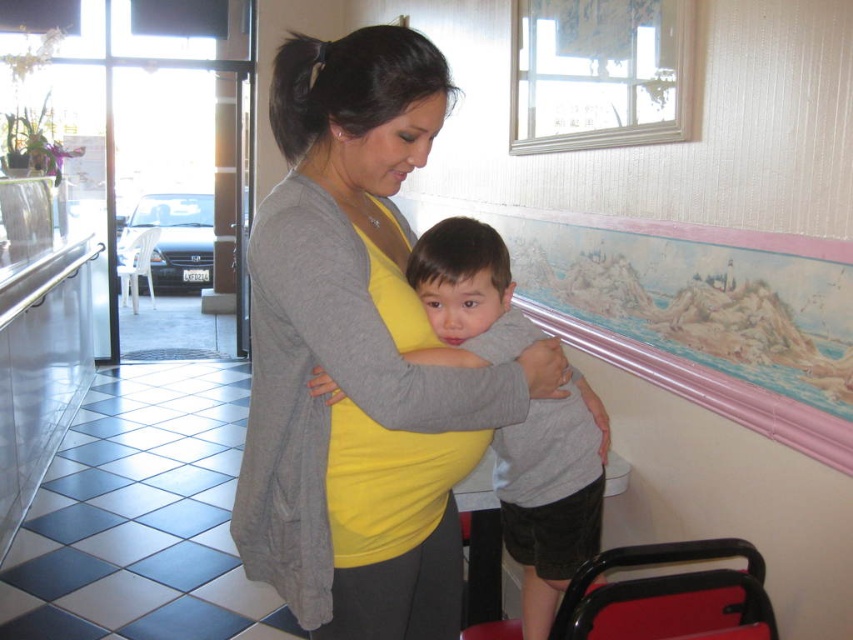
Question: Which point appears closest to the camera in this image?

Choices:
 (A) (231, 531)
 (B) (503, 474)

Answer: (A)

Question: Is matte gray cardigan at center positioned behind gray matte shirt at center?

Choices:
 (A) yes
 (B) no

Answer: (B)

Question: Does matte gray cardigan at center lie behind gray matte shirt at center?

Choices:
 (A) yes
 (B) no

Answer: (B)

Question: Which point is closer to the camera?

Choices:
 (A) (354, 147)
 (B) (576, 394)

Answer: (A)

Question: Is matte gray cardigan at center to the right of gray matte shirt at center from the viewer's perspective?

Choices:
 (A) yes
 (B) no

Answer: (B)